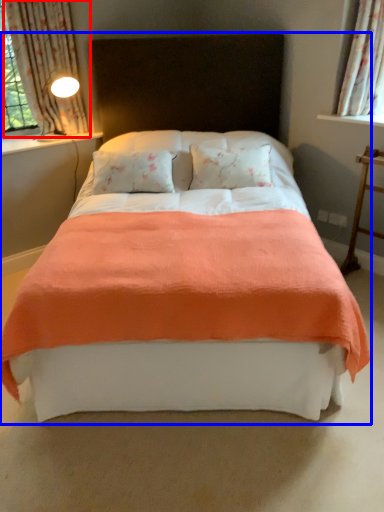
Question: Which object appears closest to the camera in this image, curtain (highlighted by a red box) or bed (highlighted by a blue box)?

Choices:
 (A) curtain
 (B) bed

Answer: (B)